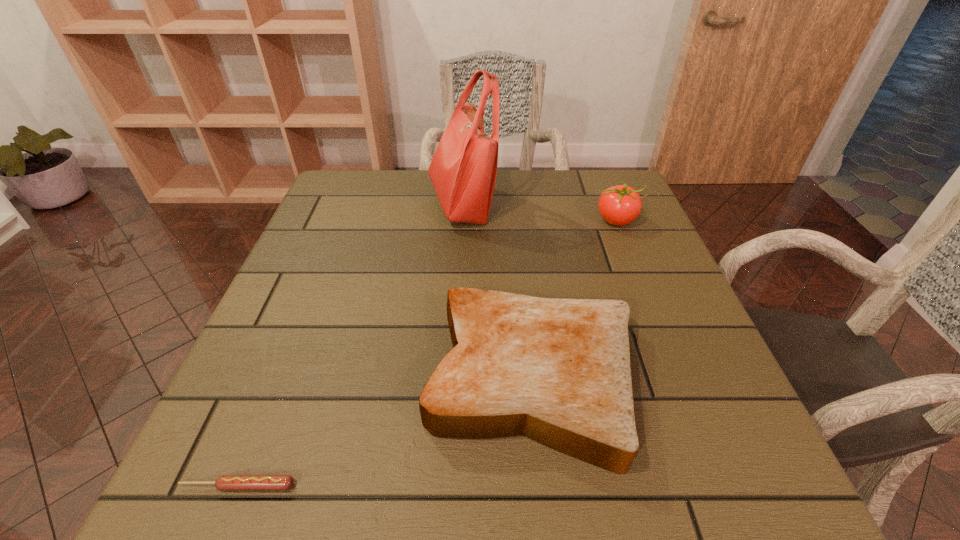
This screenshot has width=960, height=540. I want to click on handbag, so click(x=463, y=170).

The width and height of the screenshot is (960, 540). Identify the location of tomato. (619, 205).

Where is `the rightmost object`? This screenshot has width=960, height=540. the rightmost object is located at coordinates (619, 205).

This screenshot has width=960, height=540. In order to click on the second shortest object in this screenshot , I will do `click(557, 371)`.

Find the location of a particular element. bread is located at coordinates (557, 371).

The height and width of the screenshot is (540, 960). I want to click on the shortest object, so click(x=224, y=482).

The image size is (960, 540). I want to click on sausage, so click(x=224, y=482).

You are a GUI agent. You are given a task and a screenshot of the screen. Output one action in this format:
    pyautogui.click(x=<x>, y=<y>)
    Task: Click on the vacant region located on the front-facing side of the tallest object
    
    Given the screenshot: What is the action you would take?
    pyautogui.click(x=557, y=204)

Find the location of a particular element. The height and width of the screenshot is (540, 960). free spot located 0.120m on the back of the third shortest object is located at coordinates (602, 186).

Image resolution: width=960 pixels, height=540 pixels. What are the coordinates of `vacant area located 0.130m on the left of the second nearest object` in the screenshot? It's located at (351, 380).